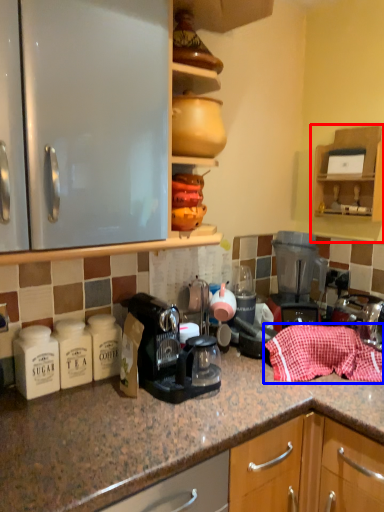
Question: Which point is further to the camera, cabinetry (highlighted by a red box) or material (highlighted by a blue box)?

Choices:
 (A) cabinetry
 (B) material

Answer: (A)